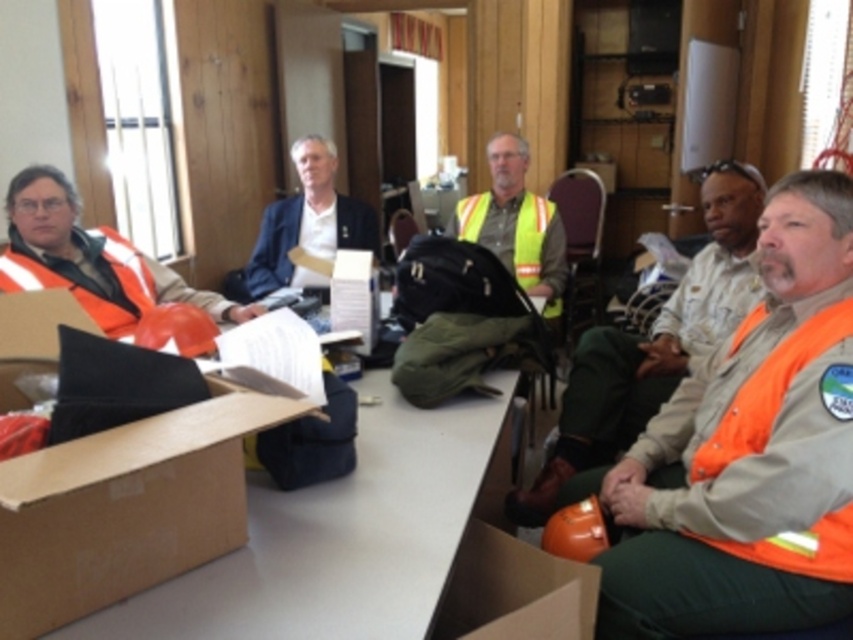
Is brown cardboard box at left closer to camera compared to orange reflective vest at right?

Yes, it is in front of orange reflective vest at right.

Is brown cardboard box at left taller than orange reflective vest at right?

Incorrect, brown cardboard box at left's height is not larger of orange reflective vest at right's.

At what (x,y) coordinates should I click in order to perform the action: click on brown cardboard box at left. Please return your answer as a coordinate pair (x, y). The width and height of the screenshot is (853, 640). Looking at the image, I should click on (125, 508).

You are a GUI agent. You are given a task and a screenshot of the screen. Output one action in this format:
    pyautogui.click(x=<x>, y=<y>)
    Task: Click on the brown cardboard box at left
    The width and height of the screenshot is (853, 640).
    Given the screenshot: What is the action you would take?
    pyautogui.click(x=125, y=508)

Is brown cardboard box at left wider than orange reflective vest at left?

Incorrect, brown cardboard box at left's width does not surpass orange reflective vest at left's.

Is brown cardboard box at left thinner than orange reflective vest at left?

Yes, brown cardboard box at left is thinner than orange reflective vest at left.

The width and height of the screenshot is (853, 640). What are the coordinates of `brown cardboard box at left` in the screenshot? It's located at (125, 508).

At what (x,y) coordinates should I click in order to perform the action: click on brown cardboard box at left. Please return your answer as a coordinate pair (x, y). The height and width of the screenshot is (640, 853). Looking at the image, I should click on (125, 508).

At what (x,y) coordinates should I click in order to perform the action: click on orange reflective vest at right. Please return your answer as a coordinate pair (x, y). Looking at the image, I should click on (653, 342).

Can you confirm if orange reflective vest at right is positioned to the right of orange reflective vest at left?

Correct, you'll find orange reflective vest at right to the right of orange reflective vest at left.

Where is `orange reflective vest at right`? Image resolution: width=853 pixels, height=640 pixels. orange reflective vest at right is located at coordinates (653, 342).

Find the location of a particular element. Image resolution: width=853 pixels, height=640 pixels. orange reflective vest at right is located at coordinates (653, 342).